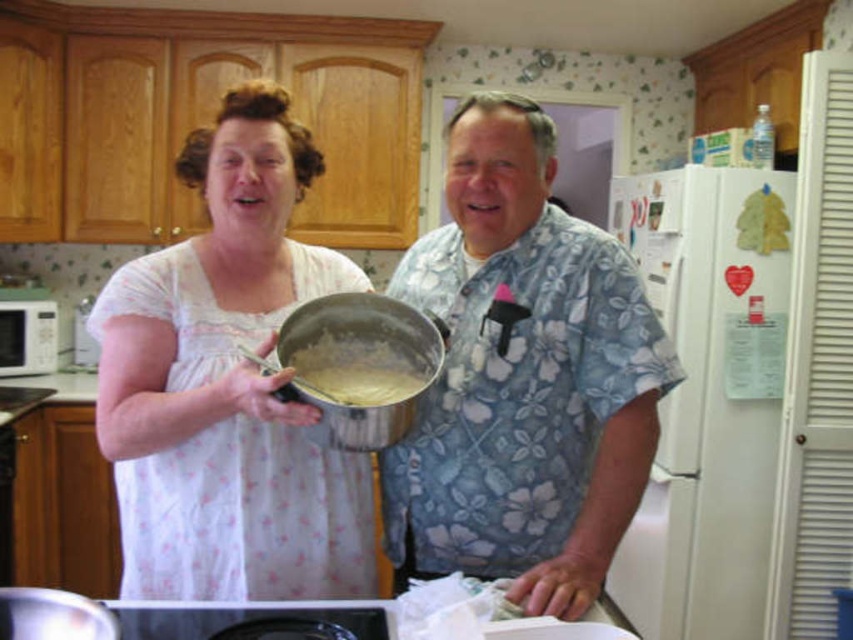
Measure the distance between blue floral shirt at center and white matte microwave at left.

A distance of 2.26 meters exists between blue floral shirt at center and white matte microwave at left.

Between blue floral shirt at center and white matte microwave at left, which one is positioned lower?

white matte microwave at left

Does point (521, 378) come farther from viewer compared to point (35, 349)?

No, it is not.

In order to click on blue floral shirt at center in this screenshot , I will do `click(523, 378)`.

Is the position of white creamy batter at center more distant than that of white matte microwave at left?

No, white creamy batter at center is in front of white matte microwave at left.

Does white creamy batter at center appear on the left side of white matte microwave at left?

No, white creamy batter at center is not to the left of white matte microwave at left.

Is point (350, 396) in front of point (15, 336)?

Yes, it is.

Locate an element on the screen. white creamy batter at center is located at coordinates (361, 365).

Which is below, white cotton dress at center or white creamy batter at center?

Positioned lower is white creamy batter at center.

Is point (335, 556) closer to viewer compared to point (393, 353)?

No, it is not.

Identify the location of white cotton dress at center. The image size is (853, 640). (228, 387).